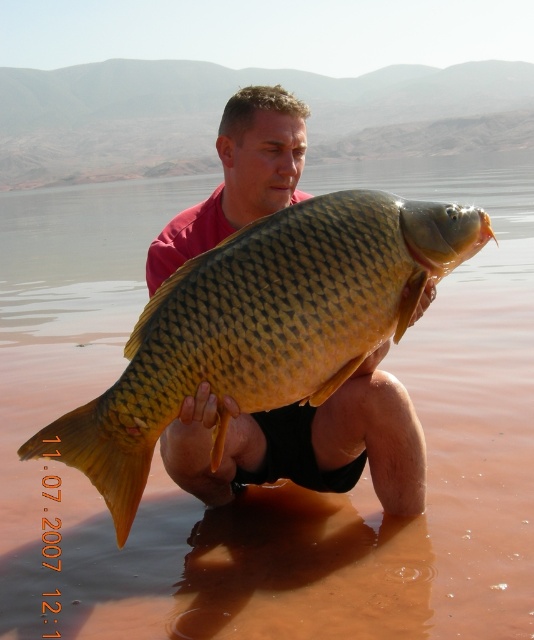
Question: Is golden scaly fish at center below matte yellow fish at center?

Choices:
 (A) no
 (B) yes

Answer: (A)

Question: Can you confirm if golden scaly fish at center is positioned above matte yellow fish at center?

Choices:
 (A) yes
 (B) no

Answer: (A)

Question: Does golden scaly fish at center have a lesser width compared to matte yellow fish at center?

Choices:
 (A) yes
 (B) no

Answer: (B)

Question: Among these points, which one is farthest from the camera?

Choices:
 (A) (365, 241)
 (B) (169, 474)

Answer: (B)

Question: Which object appears closest to the camera in this image?

Choices:
 (A) golden scaly fish at center
 (B) matte yellow fish at center

Answer: (A)